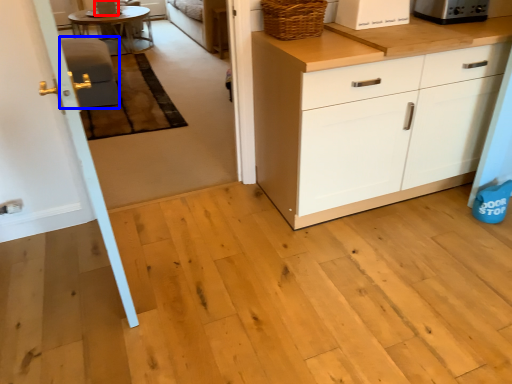
Question: Which of the following is the closest to the observer, appliance (highlighted by a red box) or armchair (highlighted by a blue box)?

Choices:
 (A) appliance
 (B) armchair

Answer: (B)